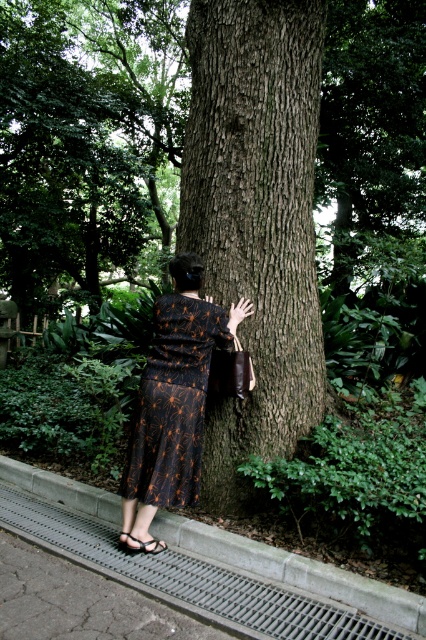
You are a photographer setting up a shot in the park. You want to position a small tripod between the gray concrete curb at lower left and the black textured dress at center. Since the tripod is 1.5 feet tall, will it fit without being blocked by either object?

The gray concrete curb at lower left is not as tall as the black textured dress at center. Since the tripod is 1.5 feet tall, it should fit between them as the curb is shorter and the dress is taller, so the tripod won